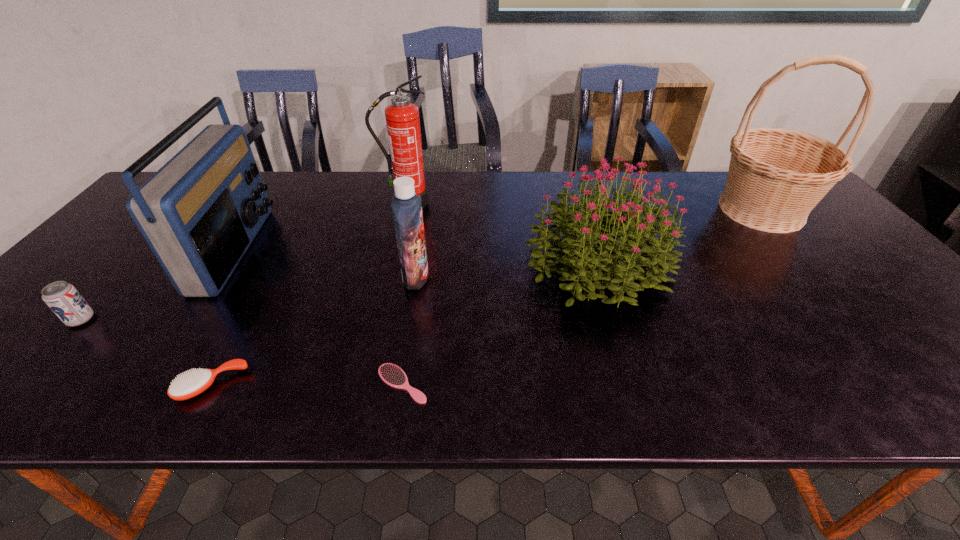
This screenshot has height=540, width=960. What are the coordinates of `fire extinguisher at the far edge` in the screenshot? It's located at (402, 118).

I want to click on radio receiver that is at the far edge, so click(x=199, y=213).

The width and height of the screenshot is (960, 540). I want to click on object that is at the left edge, so (x=64, y=300).

Locate an element on the screen. object that is positioned at the right edge is located at coordinates (776, 176).

At what (x,y) coordinates should I click in order to perform the action: click on object positioned at the far right corner. Please return your answer as a coordinate pair (x, y). The height and width of the screenshot is (540, 960). Looking at the image, I should click on (776, 176).

Locate an element on the screen. vacant area at the far edge is located at coordinates (287, 196).

In the image, there is a desktop. Where is `vacant space at the near edge`? The image size is (960, 540). vacant space at the near edge is located at coordinates (351, 407).

You are a GUI agent. You are given a task and a screenshot of the screen. Output one action in this format:
    pyautogui.click(x=<x>, y=<y>)
    Task: Click on the vacant space at the left edge
    The width and height of the screenshot is (960, 540).
    Given the screenshot: What is the action you would take?
    pyautogui.click(x=91, y=319)

Find the location of `vacant space at the right edge of the desktop`. vacant space at the right edge of the desktop is located at coordinates (939, 336).

The image size is (960, 540). I want to click on empty location between the radio receiver and the shampoo, so click(325, 263).